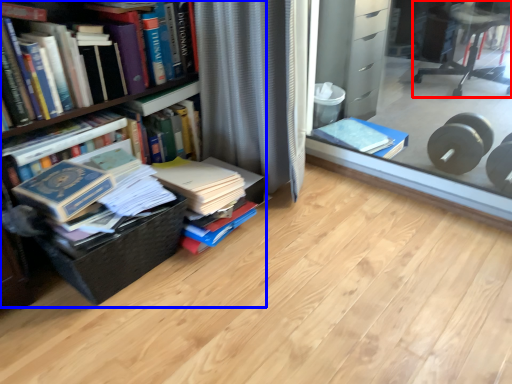
Question: Which object is closer to the camera taking this photo, chair (highlighted by a red box) or bookcase (highlighted by a blue box)?

Choices:
 (A) chair
 (B) bookcase

Answer: (B)